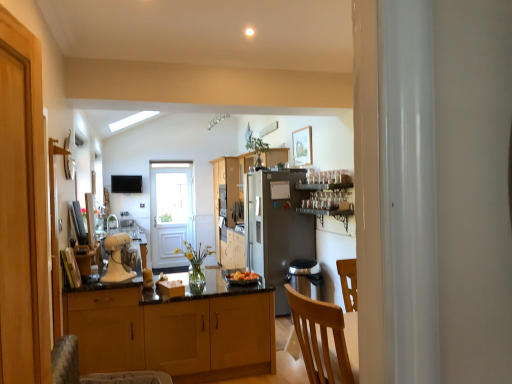
Question: Does white glossy door at center have a larger size compared to satin silver refrigerator at center?

Choices:
 (A) no
 (B) yes

Answer: (A)

Question: Can you confirm if white glossy door at center is positioned to the right of satin silver refrigerator at center?

Choices:
 (A) no
 (B) yes

Answer: (A)

Question: Is white glossy door at center oriented away from satin silver refrigerator at center?

Choices:
 (A) no
 (B) yes

Answer: (A)

Question: Is white glossy door at center completely or partially outside of satin silver refrigerator at center?

Choices:
 (A) no
 (B) yes

Answer: (B)

Question: Would you consider white glossy door at center to be distant from satin silver refrigerator at center?

Choices:
 (A) yes
 (B) no

Answer: (A)

Question: Does point (215, 167) appear closer or farther from the camera than point (260, 230)?

Choices:
 (A) closer
 (B) farther

Answer: (B)

Question: Is wooden cabinets at center, the 3th cabinetry from the front, spatially inside satin silver refrigerator at center, or outside of it?

Choices:
 (A) inside
 (B) outside

Answer: (B)

Question: Considering the relative positions of wooden cabinets at center, marked as the first cabinetry in a back-to-front arrangement, and satin silver refrigerator at center in the image provided, is wooden cabinets at center, marked as the first cabinetry in a back-to-front arrangement, to the left or to the right of satin silver refrigerator at center?

Choices:
 (A) left
 (B) right

Answer: (A)

Question: From a real-world perspective, is wooden cabinets at center, the 3th cabinetry from the front, positioned above or below satin silver refrigerator at center?

Choices:
 (A) above
 (B) below

Answer: (A)

Question: Considering the positions of green leafy plant at upper center, the 1th houseplant when ordered from right to left, and smooth orange fruit at center in the image, is green leafy plant at upper center, the 1th houseplant when ordered from right to left, taller or shorter than smooth orange fruit at center?

Choices:
 (A) tall
 (B) short

Answer: (A)

Question: Considering their positions, is green leafy plant at upper center, marked as the first houseplant in a top-to-bottom arrangement, located in front of or behind smooth orange fruit at center?

Choices:
 (A) behind
 (B) front

Answer: (A)

Question: Does point (247, 142) appear closer or farther from the camera than point (256, 274)?

Choices:
 (A) closer
 (B) farther

Answer: (B)

Question: From a real-world perspective, is green leafy plant at upper center, arranged as the 2th houseplant when viewed from the left, physically located above or below smooth orange fruit at center?

Choices:
 (A) below
 (B) above

Answer: (B)

Question: Is smooth orange fruit at center in front of or behind white glossy door at center in the image?

Choices:
 (A) front
 (B) behind

Answer: (A)

Question: Is point (242, 281) closer or farther from the camera than point (175, 243)?

Choices:
 (A) farther
 (B) closer

Answer: (B)